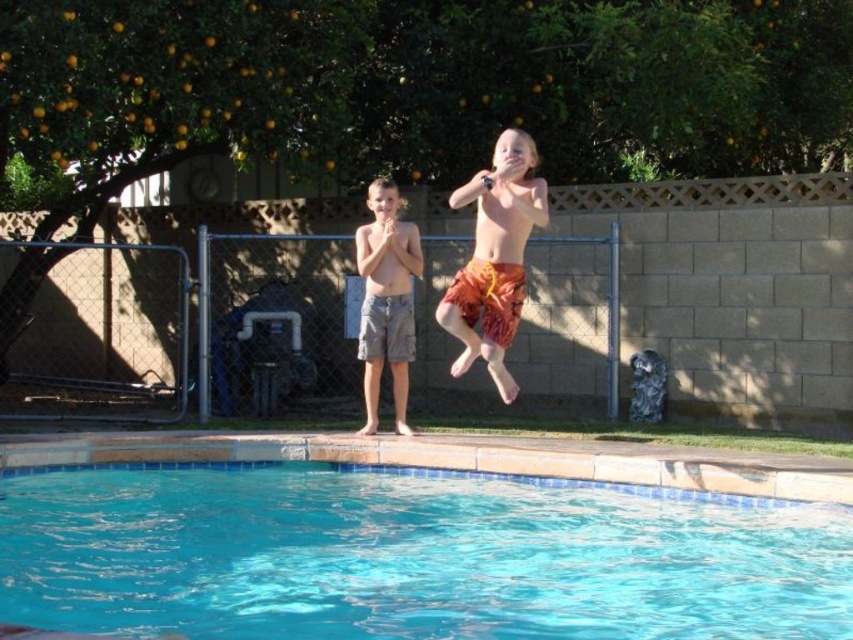
Is blue tile water at center smaller than camo shorts at center?

No.

Does point (200, 625) come behind point (409, 342)?

No, it is not.

Where is `blue tile water at center`? The height and width of the screenshot is (640, 853). blue tile water at center is located at coordinates (410, 556).

Does point (817, 604) come farther from viewer compared to point (442, 326)?

No, it is in front of (442, 326).

This screenshot has width=853, height=640. I want to click on blue tile water at center, so click(410, 556).

Which is behind, point (579, 582) or point (498, 394)?

Point (498, 394)

Identify the location of blue tile water at center. The width and height of the screenshot is (853, 640). (410, 556).

Between orange printed shorts at center and camo shorts at center, which one has more height?

Standing taller between the two is camo shorts at center.

Is orange printed shorts at center to the right of camo shorts at center from the viewer's perspective?

Yes, orange printed shorts at center is to the right of camo shorts at center.

What are the coordinates of `orange printed shorts at center` in the screenshot? It's located at [x=495, y=257].